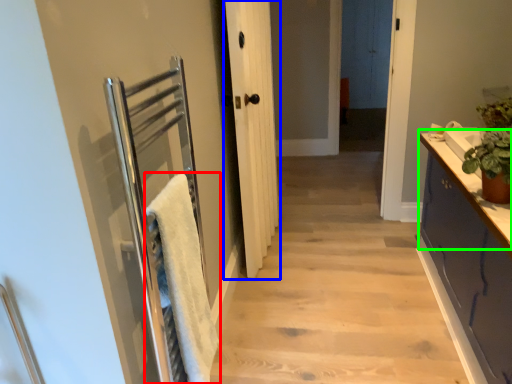
Question: Which object is positioned closest to bath towel (highlighted by a red box)? Select from door (highlighted by a blue box) and counter top (highlighted by a green box).

Choices:
 (A) door
 (B) counter top

Answer: (B)